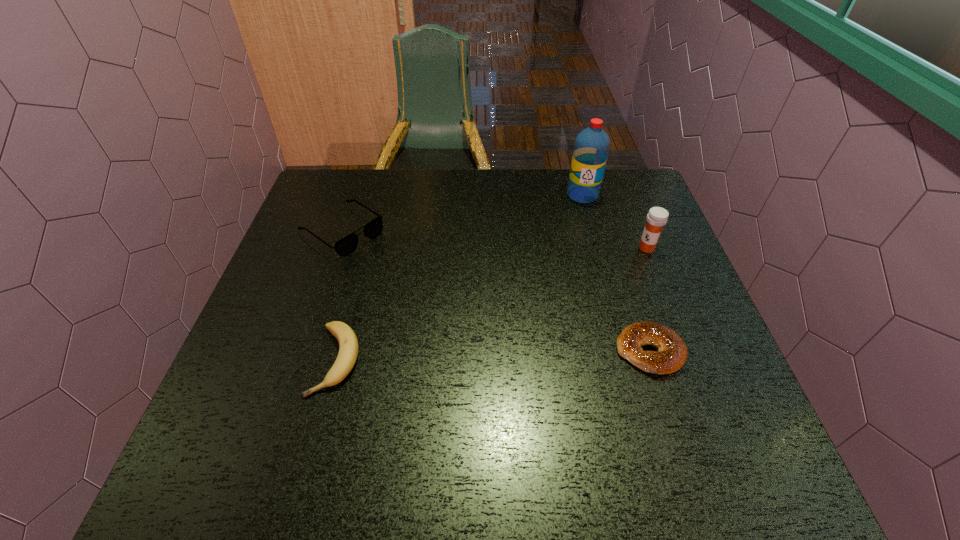
Image resolution: width=960 pixels, height=540 pixels. I want to click on spectacles that is at the left edge, so click(x=345, y=246).

Image resolution: width=960 pixels, height=540 pixels. I want to click on bagel that is positioned at the right edge, so click(x=671, y=354).

Image resolution: width=960 pixels, height=540 pixels. In order to click on medicine present at the right edge in this screenshot , I will do `click(657, 217)`.

This screenshot has height=540, width=960. In order to click on water bottle that is at the right edge in this screenshot , I will do `click(591, 148)`.

I want to click on object present at the far left corner, so click(345, 246).

The image size is (960, 540). I want to click on object present at the near left corner, so click(x=348, y=344).

You are a GUI agent. You are given a task and a screenshot of the screen. Output one action in this format:
    pyautogui.click(x=<x>, y=<y>)
    Task: Click on the object present at the far right corner
    This screenshot has height=540, width=960.
    Given the screenshot: What is the action you would take?
    pyautogui.click(x=591, y=148)

Locate an element on the screen. This screenshot has width=960, height=540. vacant area at the far edge is located at coordinates (525, 174).

Identify the location of vacant region at the right edge of the desktop. The width and height of the screenshot is (960, 540). (689, 296).

This screenshot has width=960, height=540. In order to click on free space at the far left corner of the desktop in this screenshot , I will do `click(357, 186)`.